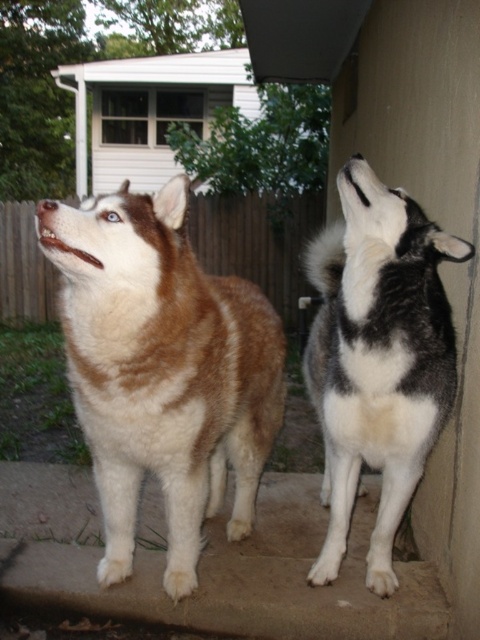
Question: Where is brown fur dog at center located in relation to black and white fur dog at upper right in the image?

Choices:
 (A) right
 (B) left

Answer: (B)

Question: Which point is farther to the camera?

Choices:
 (A) brown fur dog at center
 (B) black and white fur dog at upper right

Answer: (B)

Question: Considering the relative positions of brown fur dog at center and black and white fur dog at upper right in the image provided, where is brown fur dog at center located with respect to black and white fur dog at upper right?

Choices:
 (A) below
 (B) above

Answer: (A)

Question: Which of the following is the closest to the observer?

Choices:
 (A) black and white fur dog at upper right
 (B) brown fur dog at center

Answer: (B)

Question: Does brown fur dog at center appear on the right side of black and white fur dog at upper right?

Choices:
 (A) yes
 (B) no

Answer: (B)